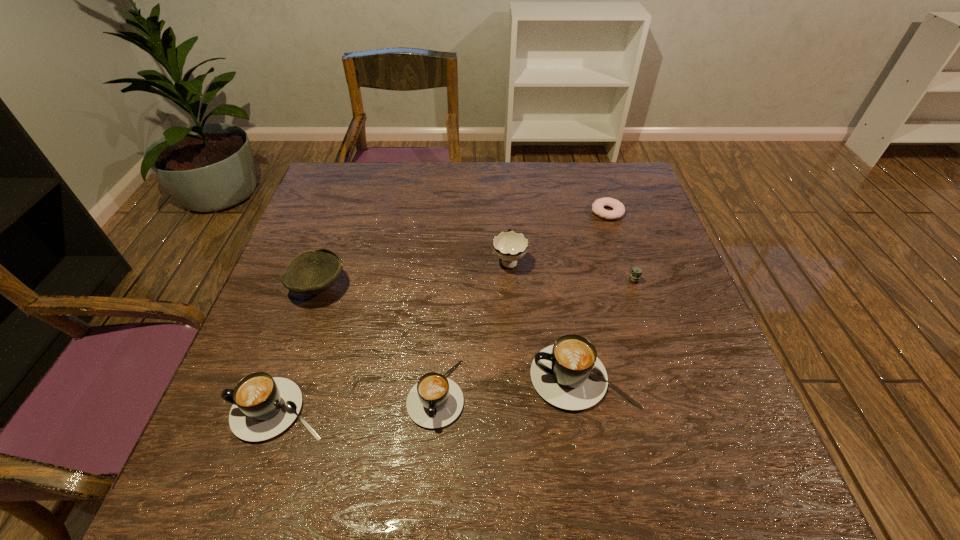
This screenshot has width=960, height=540. Find the location of `bowl at the left edge`. bowl at the left edge is located at coordinates (312, 272).

The height and width of the screenshot is (540, 960). Find the location of `doughnut positioned at the right edge`. doughnut positioned at the right edge is located at coordinates (618, 211).

Find the location of `beer can at the right edge`. beer can at the right edge is located at coordinates (636, 272).

Where is `object at the near left corner`? object at the near left corner is located at coordinates (263, 407).

This screenshot has width=960, height=540. What are the coordinates of `object that is at the far right corner` in the screenshot? It's located at (618, 211).

Image resolution: width=960 pixels, height=540 pixels. In the image, there is a desktop. What are the coordinates of `free space at the far edge` in the screenshot? It's located at (548, 186).

Identify the location of vacant space at the left edge of the desktop. (277, 300).

Identify the location of free space at the right edge of the desktop. (703, 345).

Identify the location of vacant space at the far left corner. Image resolution: width=960 pixels, height=540 pixels. (343, 168).

Find the location of a particular element. The width and height of the screenshot is (960, 540). free space at the far right corner of the desktop is located at coordinates (627, 161).